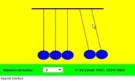
The width and height of the screenshot is (135, 81). I want to click on bar, so click(x=61, y=8).